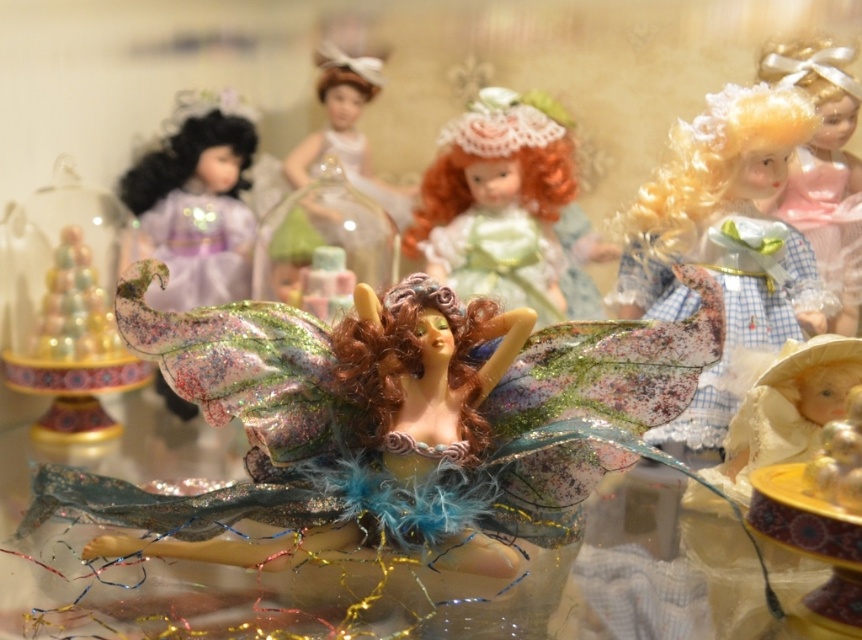
Is checkered fabric dress at right to the left of pastel plaid dress at right from the viewer's perspective?

Correct, you'll find checkered fabric dress at right to the left of pastel plaid dress at right.

Does point (695, 250) lie behind point (856, 116)?

No, (695, 250) is closer to viewer.

Is point (731, 224) positioned before point (778, 54)?

That is True.

The width and height of the screenshot is (862, 640). In order to click on checkered fabric dress at right in this screenshot , I will do `click(723, 244)`.

Does pastel glitter fairy at center have a greater width compared to matte white doll at upper center?

Indeed, pastel glitter fairy at center has a greater width compared to matte white doll at upper center.

Between point (105, 269) and point (350, 145), which one is positioned in front?

Point (105, 269) is more forward.

Looking at this image, who is more forward, (x=80, y=228) or (x=355, y=134)?

Point (x=80, y=228)

Identify the location of pastel glitter fairy at center. (67, 307).

Does checkered fabric dress at right appear on the left side of pastel glitter fairy at center?

Incorrect, checkered fabric dress at right is not on the left side of pastel glitter fairy at center.

Which of these two, checkered fabric dress at right or pastel glitter fairy at center, stands shorter?

pastel glitter fairy at center

Describe the element at coordinates (723, 244) in the screenshot. I see `checkered fabric dress at right` at that location.

Where is `checkered fabric dress at right`? Image resolution: width=862 pixels, height=640 pixels. checkered fabric dress at right is located at coordinates (723, 244).